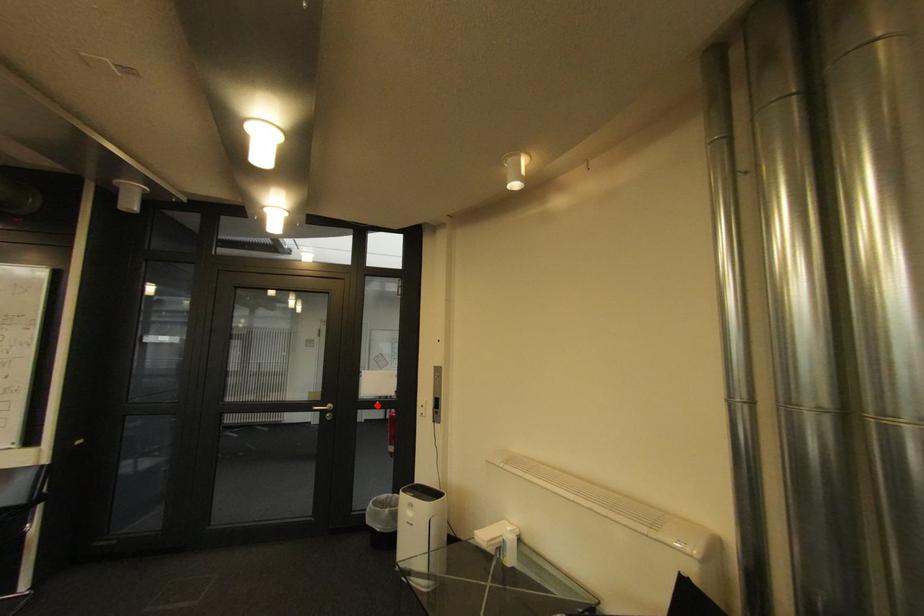
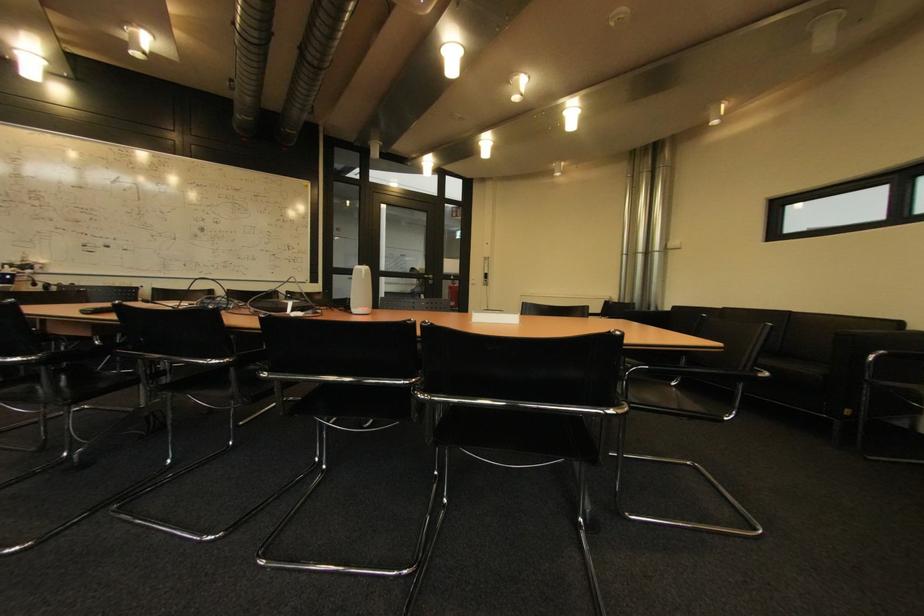
Question: I am providing you with two images of the same scene from different viewpoints. Image1 has a red point marked. In image2, the corresponding 3D location appears at what relative position? Reply with the corresponding letter.

Choices:
 (A) Closer
 (B) Farther

Answer: (A)